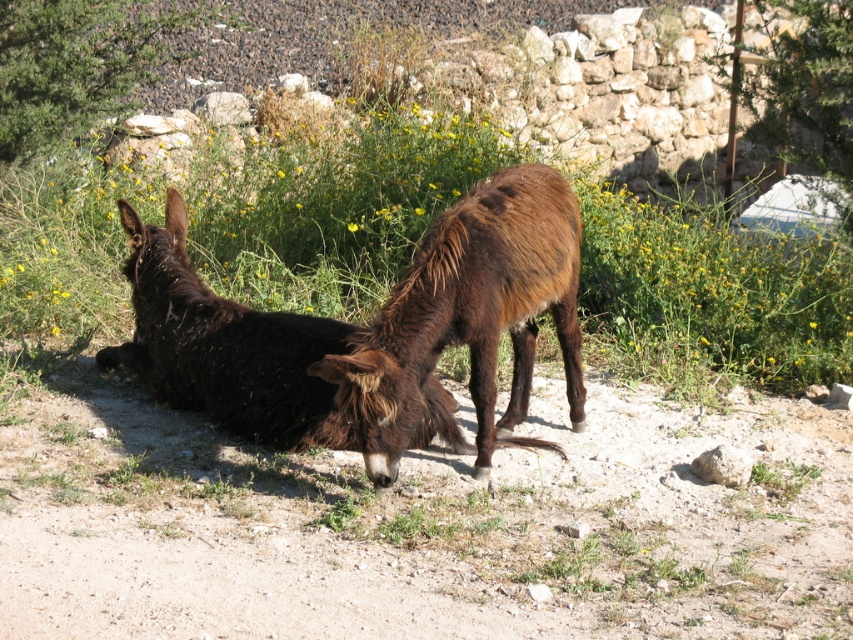
Looking at this image, between brown fuzzy donkey at center and dark brown fur donkey at lower left, which one has more height?

brown fuzzy donkey at center

Which is behind, point (486, 330) or point (283, 365)?

Point (283, 365)

Where is `brown fuzzy donkey at center`? brown fuzzy donkey at center is located at coordinates (468, 316).